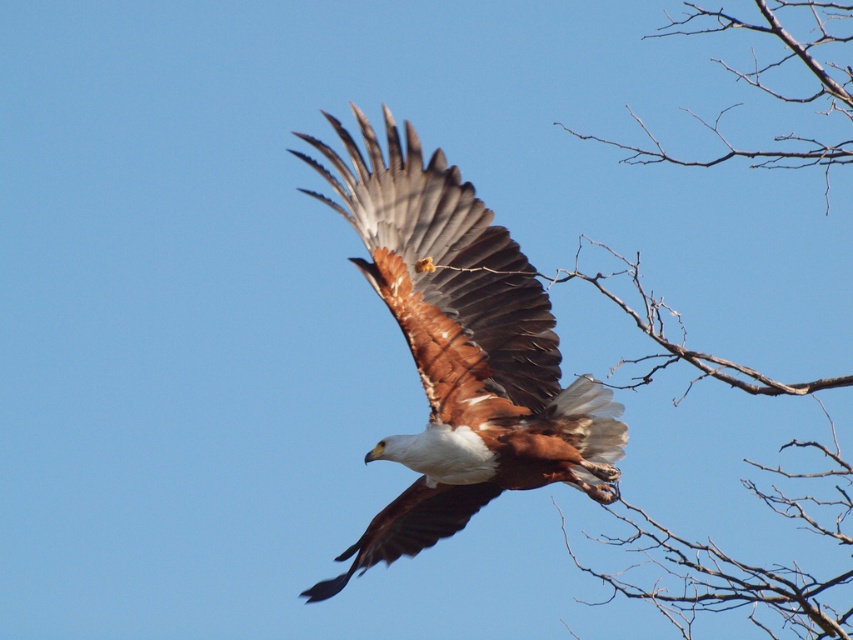
Between brown feathered eagle at center and bare wood at upper right, which one is positioned lower?

Positioned lower is brown feathered eagle at center.

Is point (549, 376) positioned before point (698, 19)?

Yes, point (549, 376) is closer to viewer.

Locate an element on the screen. The width and height of the screenshot is (853, 640). brown feathered eagle at center is located at coordinates (462, 352).

Which is more to the right, bare branches at right or bare wood at upper right?

bare wood at upper right is more to the right.

I want to click on bare branches at right, so click(x=724, y=582).

The height and width of the screenshot is (640, 853). Find the location of `bare branches at right`. bare branches at right is located at coordinates (724, 582).

Is point (445, 339) positioned in front of point (790, 611)?

Yes, it is in front of point (790, 611).

Between brown feathered eagle at center and bare branches at right, which one appears on the left side from the viewer's perspective?

brown feathered eagle at center

Locate an element on the screen. The height and width of the screenshot is (640, 853). brown feathered eagle at center is located at coordinates (462, 352).

Locate an element on the screen. The image size is (853, 640). brown feathered eagle at center is located at coordinates (462, 352).